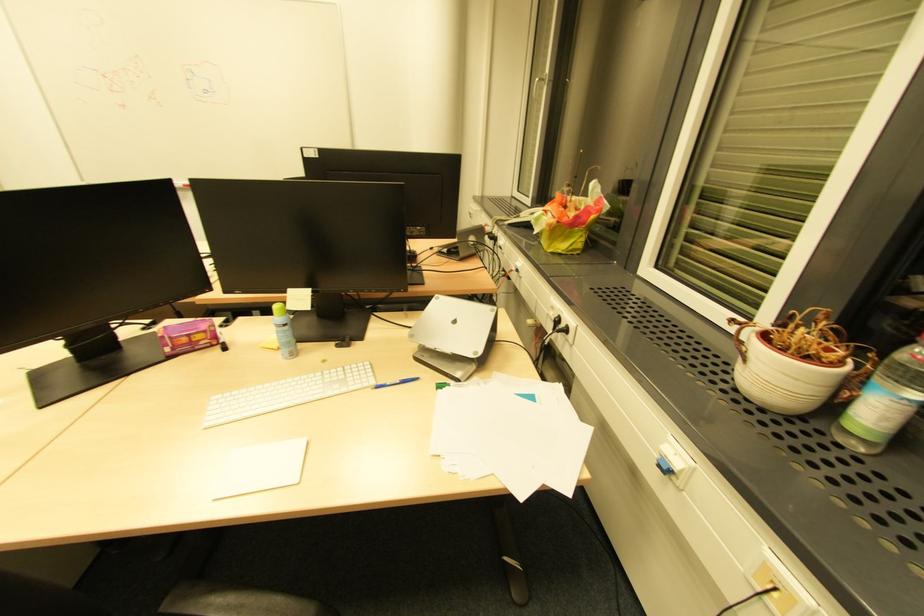
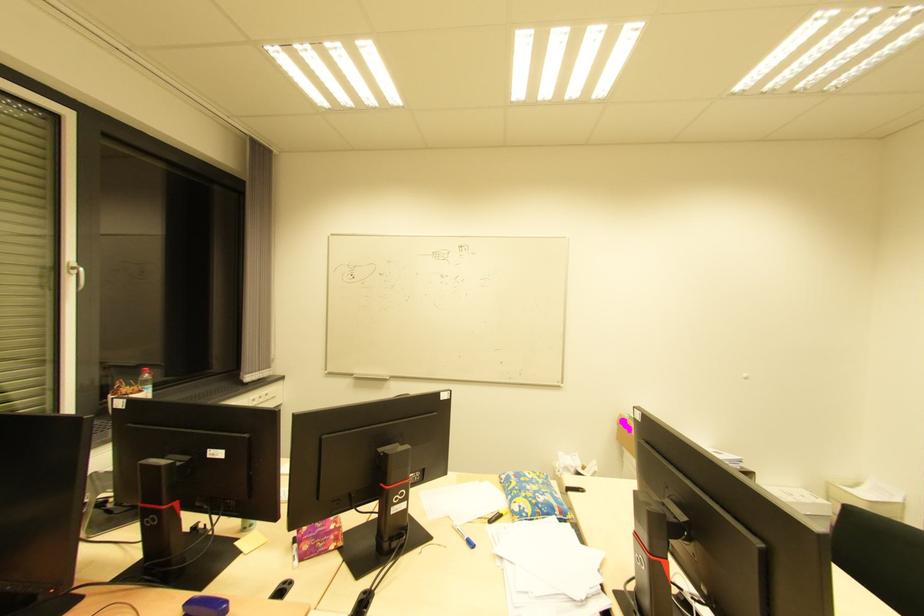
Question: I am providing you with two images of the same scene from different viewpoints. After the viewpoint changes to image2, which objects are now occluded?

Choices:
 (A) blue patterned pillow
 (B) black portable speaker
 (C) clear water bottle
 (D) white computer keyboard

Answer: (D)